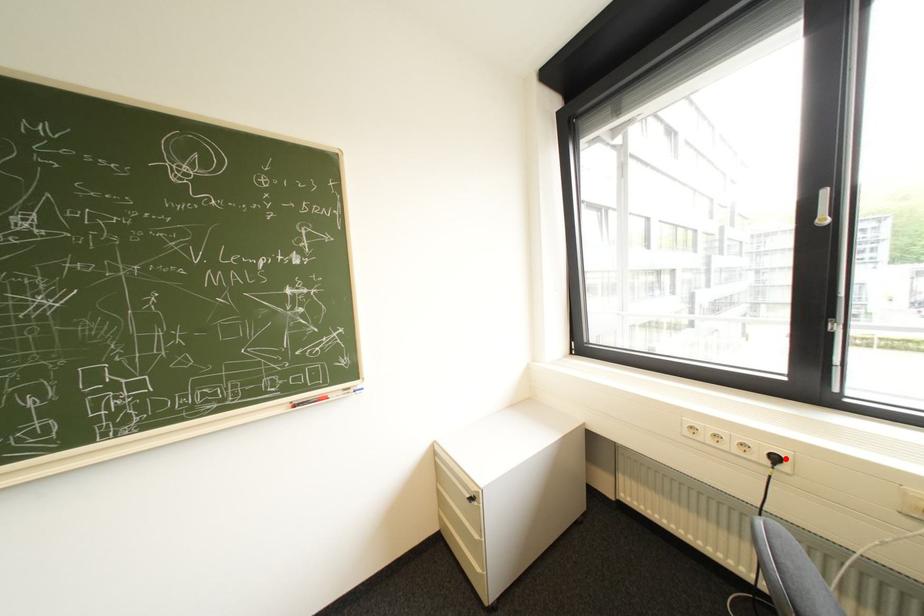
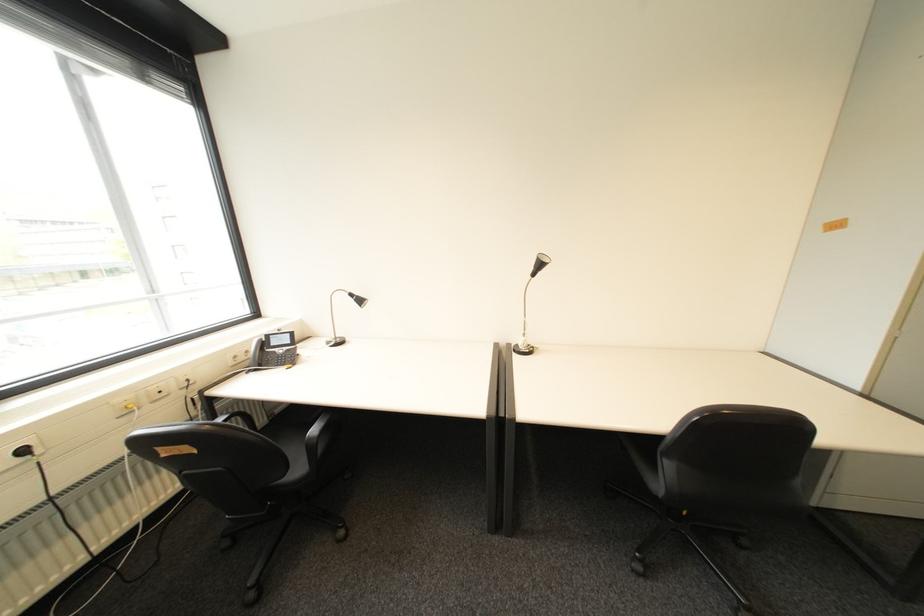
The point at the highlighted location is marked in the first image. Where is the corresponding point in the second image?

(34, 452)